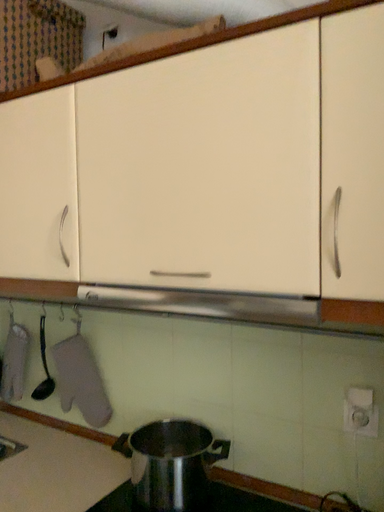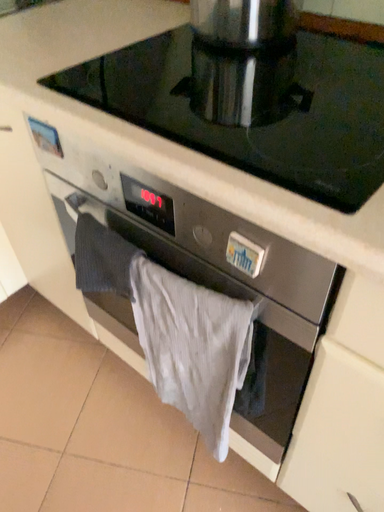
Question: How did the camera likely rotate when shooting the video?

Choices:
 (A) rotated upward
 (B) rotated downward

Answer: (B)